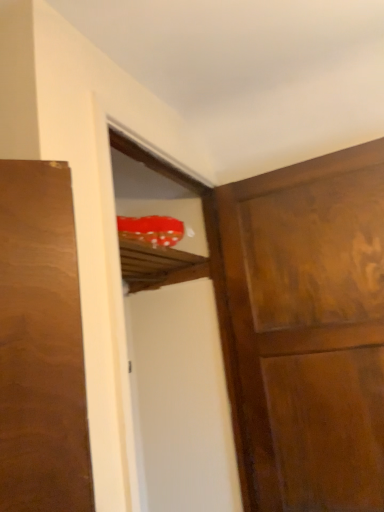
At what (x,y) coordinates should I click in order to perform the action: click on transparent plastic screen door at upper center. Please return your answer as a coordinate pair (x, y). Looking at the image, I should click on (174, 344).

What do you see at coordinates (174, 344) in the screenshot? This screenshot has width=384, height=512. I see `transparent plastic screen door at upper center` at bounding box center [174, 344].

Where is `wooden door at upper right`? Image resolution: width=384 pixels, height=512 pixels. wooden door at upper right is located at coordinates (309, 329).

This screenshot has height=512, width=384. What do you see at coordinates (309, 329) in the screenshot?
I see `wooden door at upper right` at bounding box center [309, 329].

At what (x,y) coordinates should I click in order to perform the action: click on transparent plastic screen door at upper center. Please return your answer as a coordinate pair (x, y). This screenshot has height=512, width=384. Looking at the image, I should click on (174, 344).

Considering the relative positions of wooden door at upper right and transparent plastic screen door at upper center in the image provided, is wooden door at upper right to the left of transparent plastic screen door at upper center from the viewer's perspective?

Incorrect, wooden door at upper right is not on the left side of transparent plastic screen door at upper center.

Which object is more forward, wooden door at upper right or transparent plastic screen door at upper center?

transparent plastic screen door at upper center is more forward.

Is point (286, 412) less distant than point (186, 331)?

Yes, point (286, 412) is in front of point (186, 331).

From the image's perspective, would you say wooden door at upper right is positioned over transparent plastic screen door at upper center?

Actually, wooden door at upper right appears below transparent plastic screen door at upper center in the image.

From a real-world perspective, who is located higher, wooden door at upper right or transparent plastic screen door at upper center?

From a 3D spatial view, transparent plastic screen door at upper center is above.

Which object is thinner, wooden door at upper right or transparent plastic screen door at upper center?

With smaller width is wooden door at upper right.

Considering the relative sizes of wooden door at upper right and transparent plastic screen door at upper center in the image provided, is wooden door at upper right taller than transparent plastic screen door at upper center?

Result: In fact, wooden door at upper right may be shorter than transparent plastic screen door at upper center.

Considering the sizes of objects wooden door at upper right and transparent plastic screen door at upper center in the image provided, who is smaller, wooden door at upper right or transparent plastic screen door at upper center?

wooden door at upper right.

Would you say wooden door at upper right is inside or outside transparent plastic screen door at upper center?

wooden door at upper right is located beyond the bounds of transparent plastic screen door at upper center.

Consider the image. Are wooden door at upper right and transparent plastic screen door at upper center making contact?

wooden door at upper right is not next to transparent plastic screen door at upper center, and they're not touching.

Could you tell me if wooden door at upper right is facing transparent plastic screen door at upper center?

Yes, wooden door at upper right is facing transparent plastic screen door at upper center.

Locate an element on the screen. door behind the transparent plastic screen door at upper center is located at coordinates (309, 329).

Does transparent plastic screen door at upper center appear on the left side of wooden door at upper right?

Yes, transparent plastic screen door at upper center is to the left of wooden door at upper right.

Is transparent plastic screen door at upper center positioned behind wooden door at upper right?

That is False.

Which is less distant, (166, 341) or (273, 344)?

The point (273, 344) is closer.

From the image's perspective, which object appears higher, transparent plastic screen door at upper center or wooden door at upper right?

transparent plastic screen door at upper center.

From a real-world perspective, is transparent plastic screen door at upper center physically above wooden door at upper right?

Indeed, from a real-world perspective, transparent plastic screen door at upper center stands above wooden door at upper right.

Is transparent plastic screen door at upper center wider than wooden door at upper right?

Yes.

Is transparent plastic screen door at upper center taller than wooden door at upper right?

Yes, transparent plastic screen door at upper center is taller than wooden door at upper right.

Between transparent plastic screen door at upper center and wooden door at upper right, which one has larger size?

transparent plastic screen door at upper center is bigger.

Choose the correct answer: Is transparent plastic screen door at upper center inside wooden door at upper right or outside it?

The correct answer is: outside.

Is transparent plastic screen door at upper center next to wooden door at upper right and touching it?

No, transparent plastic screen door at upper center is not making contact with wooden door at upper right.

Is transparent plastic screen door at upper center positioned with its back to wooden door at upper right?

No, transparent plastic screen door at upper center's orientation is not away from wooden door at upper right.

How different are the orientations of transparent plastic screen door at upper center and wooden door at upper right in degrees?

They differ by 88.9 degrees in their facing directions.

In the image, there is a transparent plastic screen door at upper center. At what (x,y) coordinates should I click in order to perform the action: click on door below it (from a real-world perspective). Please return your answer as a coordinate pair (x, y). The height and width of the screenshot is (512, 384). Looking at the image, I should click on (309, 329).

This screenshot has width=384, height=512. What are the coordinates of `screen door located above the wooden door at upper right (from the image's perspective)` in the screenshot? It's located at (174, 344).

Where is `screen door that appears on the left of wooden door at upper right`? The height and width of the screenshot is (512, 384). screen door that appears on the left of wooden door at upper right is located at coordinates (174, 344).